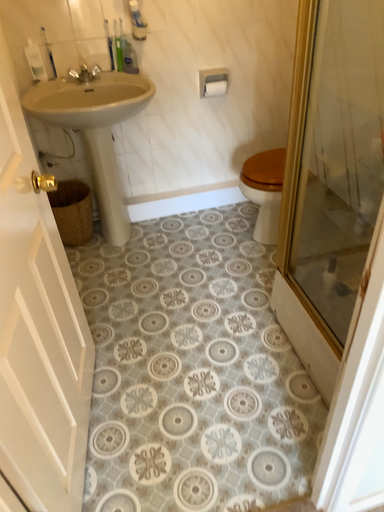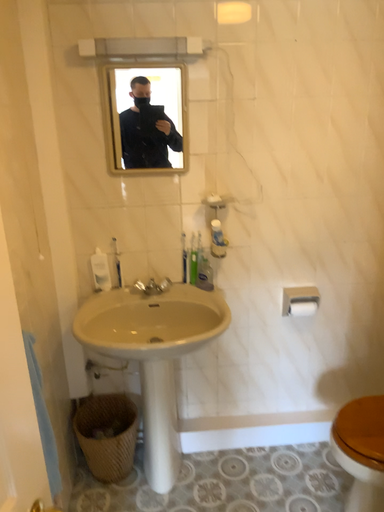
Question: Which way did the camera rotate in the video?

Choices:
 (A) rotated right
 (B) rotated left

Answer: (B)